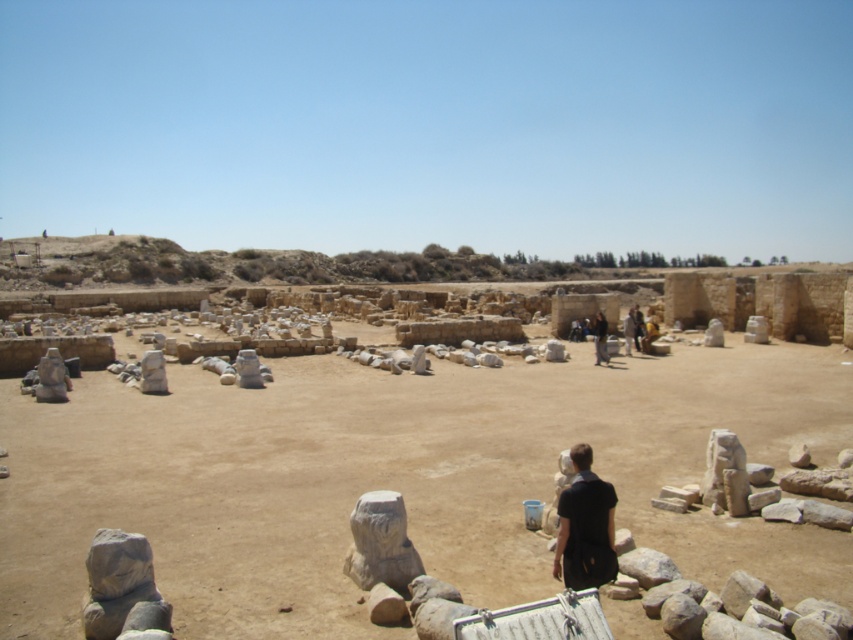
Does black matte shirt at center appear over dark brown leather jacket at center?

No.

Can you confirm if black matte shirt at center is smaller than dark brown leather jacket at center?

Correct, black matte shirt at center occupies less space than dark brown leather jacket at center.

Is point (607, 484) positioned after point (607, 358)?

That is False.

Locate an element on the screen. The width and height of the screenshot is (853, 640). black matte shirt at center is located at coordinates (585, 525).

Does brown sandy dirt at center have a greater width compared to black matte shirt at center?

Yes, brown sandy dirt at center is wider than black matte shirt at center.

Can you confirm if brown sandy dirt at center is positioned to the left of black matte shirt at center?

In fact, brown sandy dirt at center is to the right of black matte shirt at center.

Measure the distance between point (148, 401) and camera.

A distance of 22.29 meters exists between point (148, 401) and camera.

Image resolution: width=853 pixels, height=640 pixels. What are the coordinates of `brown sandy dirt at center` in the screenshot? It's located at (399, 477).

Which is above, brown sandy dirt at center or dark brown leather jacket at center?

dark brown leather jacket at center is above.

The height and width of the screenshot is (640, 853). I want to click on brown sandy dirt at center, so click(399, 477).